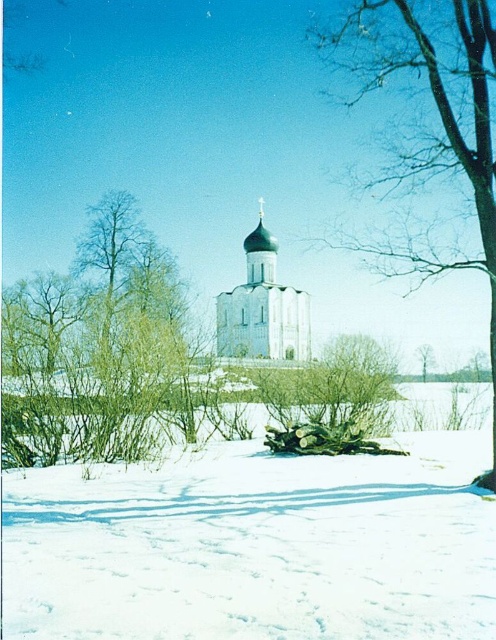
You are standing at the point marked by the coordinates point [98,349] in the winter landscape. What object is exactly at your current location?

The green leafy shrub at left is located at point [98,349].

You are standing at the point closest to the church in the winter landscape. Which of the two points, point (407, 586) or point (392, 20), is closer to you?

Point (392, 20) is closer to you because it is behind point (407, 586), which is in front.

In the scene shown: You are an architect examining the winter landscape. You notice the green leafy shrub at left and the green leafy tree at center. Which one has a greater height?

The green leafy shrub at left is much taller than the green leafy tree at center, so the shrub has a greater height.